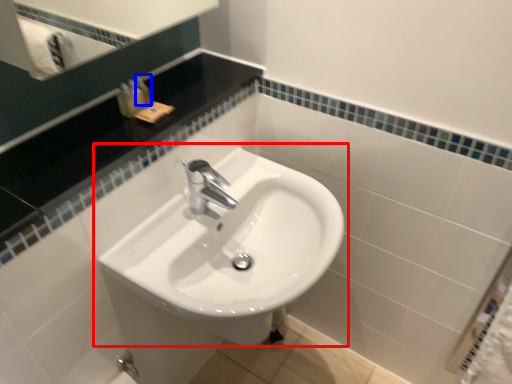
Question: Among these objects, which one is nearest to the camera, sink (highlighted by a red box) or toiletry (highlighted by a blue box)?

Choices:
 (A) sink
 (B) toiletry

Answer: (A)